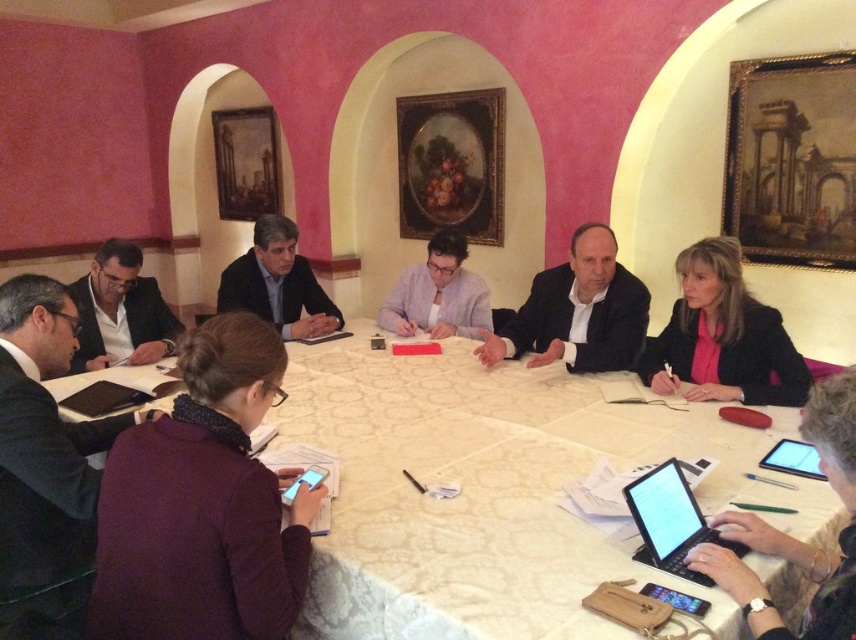
Based on the photo, you are standing at the center of the room looking towards the table. There are two points marked on the table surface. One is labeled as point (x=3, y=544) and the other as point (x=830, y=426). Which point is closer to you?

Point (x=830, y=426) is closer to you because it is in front of point (x=3, y=544).

You are standing at the entrance of the room. You need to locate the black suit at lower left. Which direction should you look to find it?

You should look to the lower left direction to find the black suit at lower left since it is located at point (45, 467).

You are a photographer positioned at the back of the room. You want to take a photo of the purple sweater at lower left and the matte black suit at left. Which object will appear closer to you in the photo?

The purple sweater at lower left will appear closer to you in the photo because it is positioned in front of the matte black suit at left.